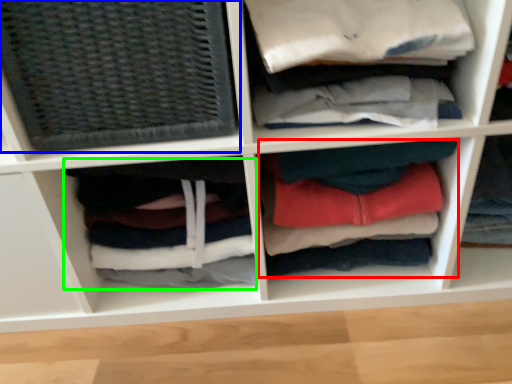
Question: Based on their relative distances, which object is farther from clothing (highlighted by a red box)? Choose from basket (highlighted by a blue box) and clothing (highlighted by a green box).

Choices:
 (A) basket
 (B) clothing

Answer: (A)